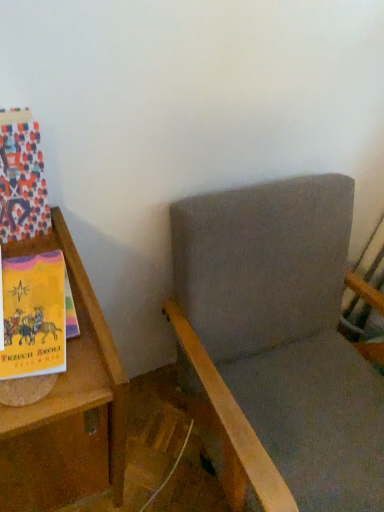
Question: Is gray fabric rocking chair at center inside or outside of multicolored paper at left?

Choices:
 (A) inside
 (B) outside

Answer: (B)

Question: Does point (365, 409) appear closer or farther from the camera than point (13, 168)?

Choices:
 (A) farther
 (B) closer

Answer: (A)

Question: Which is nearer to the wooden bookshelf at left?

Choices:
 (A) multicolored paper at left
 (B) gray fabric rocking chair at center

Answer: (A)

Question: Which is farther from the wooden bookshelf at left?

Choices:
 (A) multicolored paper at left
 (B) gray fabric rocking chair at center

Answer: (B)